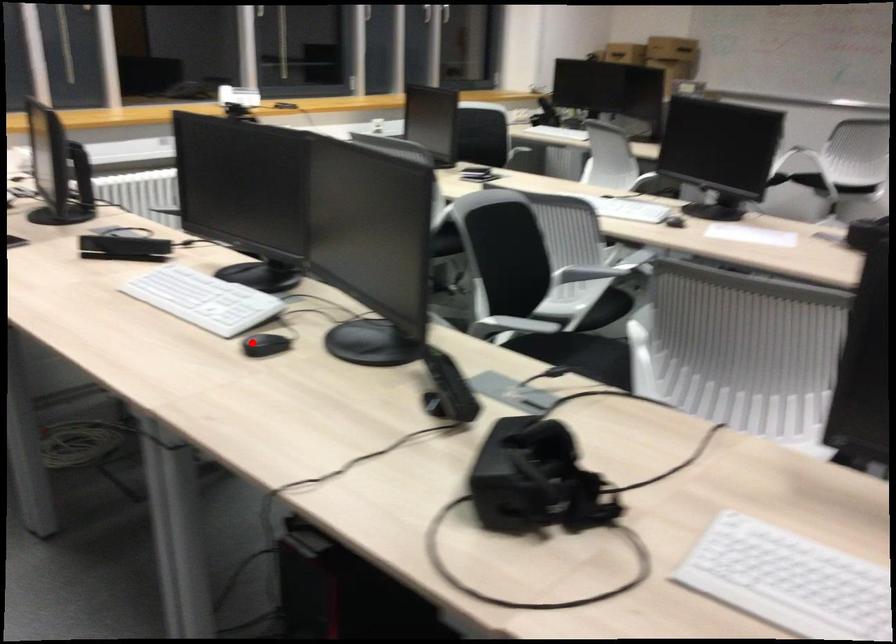
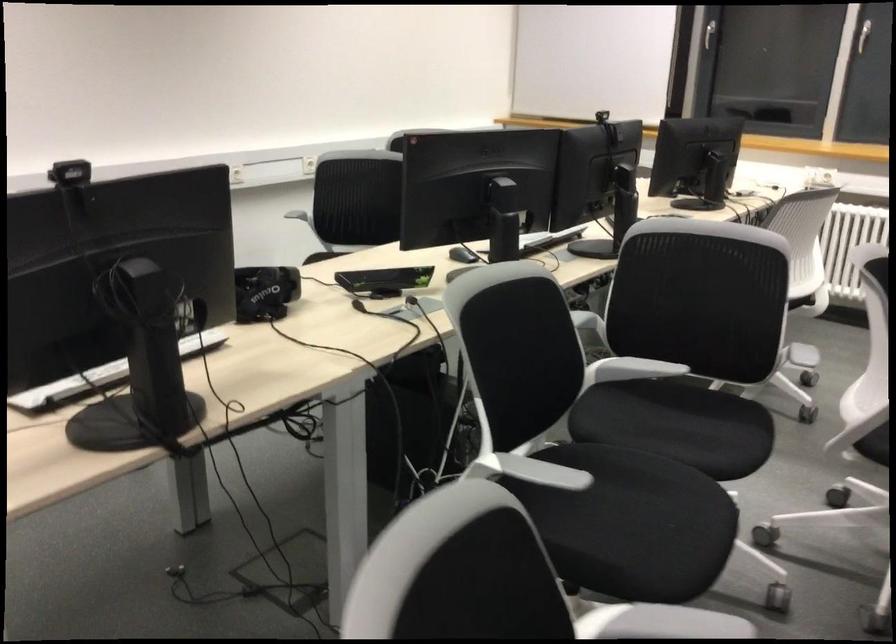
Question: I am providing you with two images of the same scene from different viewpoints. A red point is shown in image1. For the corresponding object point in image2, is it positioned nearer or farther from the camera?

Choices:
 (A) Nearer
 (B) Farther

Answer: (B)